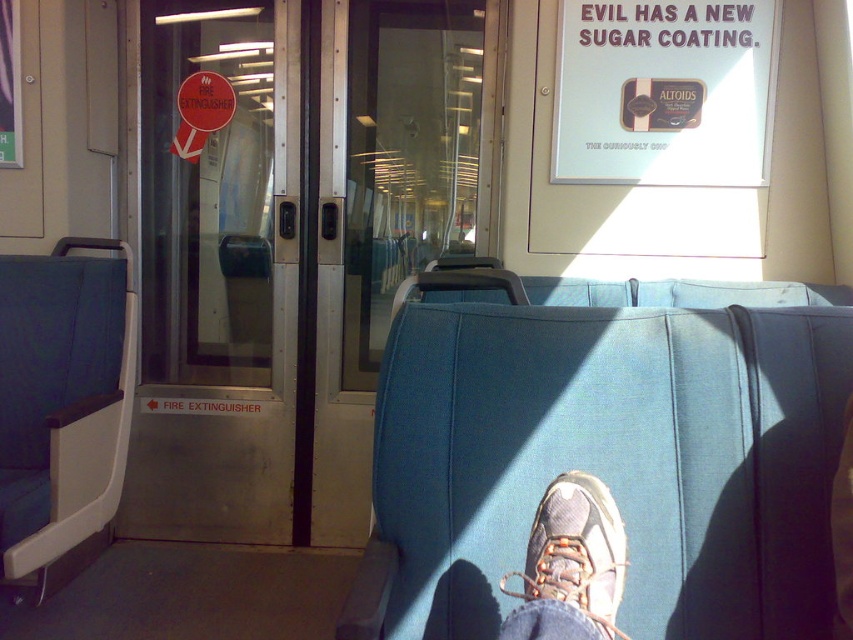
Does blue fabric seat at center appear over camouflage fabric sneaker at lower center?

Indeed, blue fabric seat at center is positioned over camouflage fabric sneaker at lower center.

Does point (467, 486) lie behind point (544, 490)?

Yes, point (467, 486) is behind point (544, 490).

Is point (711, 307) closer to viewer compared to point (550, 522)?

No, it is behind (550, 522).

Locate an element on the screen. The height and width of the screenshot is (640, 853). blue fabric seat at center is located at coordinates (607, 448).